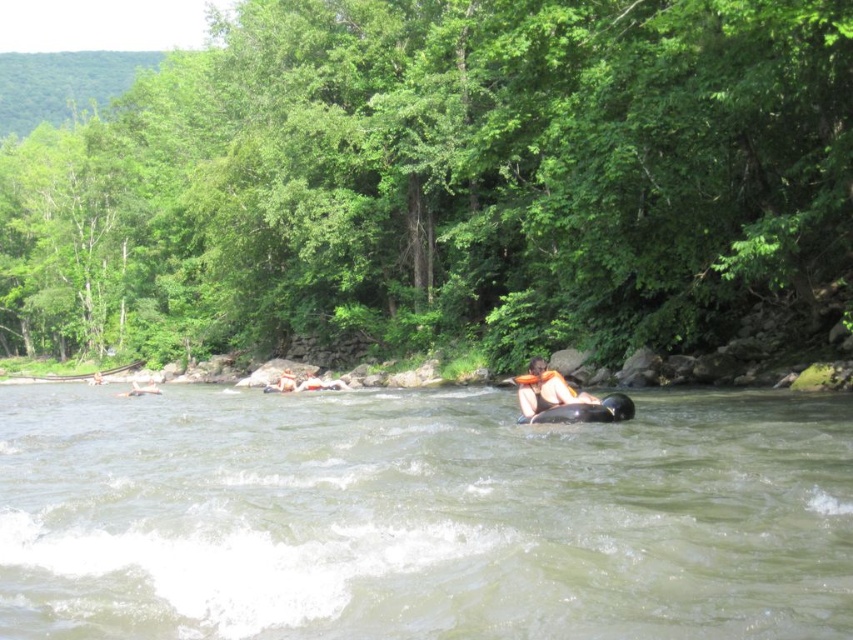
Which is more to the right, black rubber tube at center or rubber black tube at center?

rubber black tube at center

Where is `black rubber tube at center`? This screenshot has width=853, height=640. black rubber tube at center is located at coordinates (x=421, y=516).

Between black rubber tube at center and orange fabric life jacket at center, which one is positioned lower?

black rubber tube at center

Is black rubber tube at center closer to the viewer compared to orange fabric life jacket at center?

Yes, black rubber tube at center is in front of orange fabric life jacket at center.

Does point (616, 465) come farther from viewer compared to point (532, 372)?

No, it is not.

Find the location of a particular element. black rubber tube at center is located at coordinates (421, 516).

Looking at this image, which is above, rubber black tube at center or orange fabric life jacket at center?

orange fabric life jacket at center is higher up.

Who is more forward, (578,404) or (524,384)?

Positioned in front is point (578,404).

Does point (520, 420) lie in front of point (531, 385)?

No.

Where is `rubber black tube at center`? rubber black tube at center is located at coordinates (585, 412).